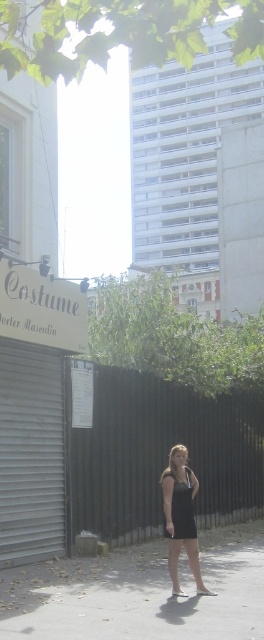
Does gray concrete pavement at lower center have a smaller size compared to white matte sign at upper left?

Actually, gray concrete pavement at lower center might be larger than white matte sign at upper left.

Which of these two, gray concrete pavement at lower center or white matte sign at upper left, stands shorter?

Standing shorter between the two is white matte sign at upper left.

Does point (184, 564) come closer to viewer compared to point (83, 316)?

That is True.

The width and height of the screenshot is (264, 640). In order to click on gray concrete pavement at lower center in this screenshot , I will do `click(139, 593)`.

Is white matte sign at upper left closer to camera compared to black satin dress at center?

No, it is not.

Does white matte sign at upper left have a lesser width compared to black satin dress at center?

No, white matte sign at upper left is not thinner than black satin dress at center.

Who is more forward, [53,282] or [180,534]?

Positioned in front is point [180,534].

Where is `white matte sign at upper left`? white matte sign at upper left is located at coordinates (41, 308).

Can you confirm if black dress at center is thinner than black satin dress at center?

No, black dress at center is not thinner than black satin dress at center.

Consider the image. Is black dress at center taller than black satin dress at center?

Yes.

What do you see at coordinates (181, 516) in the screenshot? The image size is (264, 640). I see `black dress at center` at bounding box center [181, 516].

Locate an element on the screen. black dress at center is located at coordinates (181, 516).